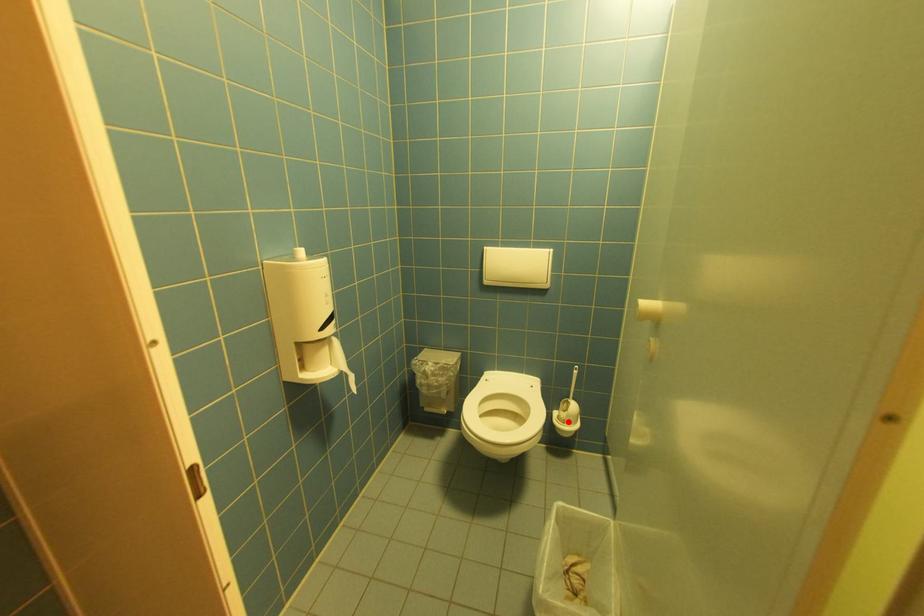
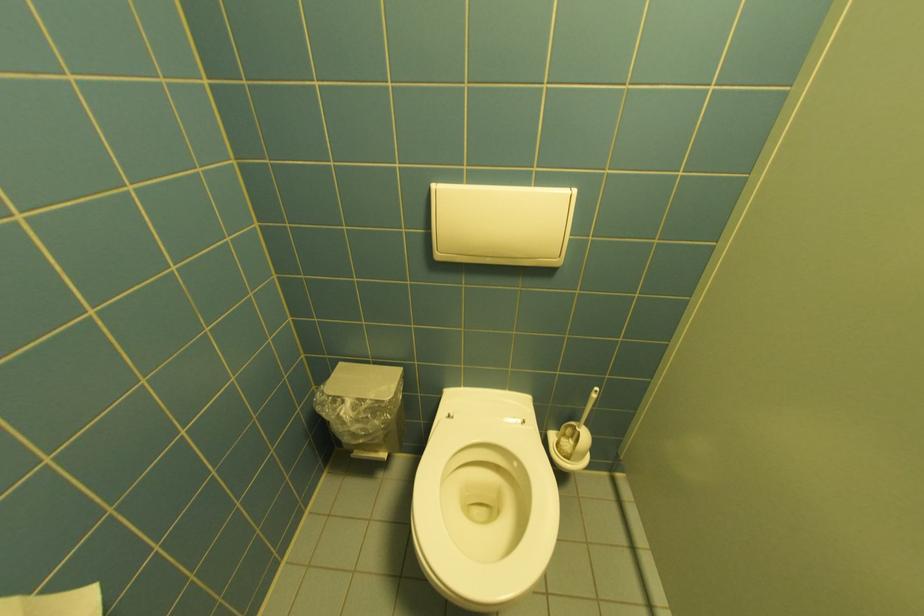
Question: I am providing you with two images of the same scene from different viewpoints. Image1 has a red point marked. In image2, the corresponding 3D location appears at what relative position? Reply with the corresponding letter.

Choices:
 (A) Closer
 (B) Farther

Answer: (A)